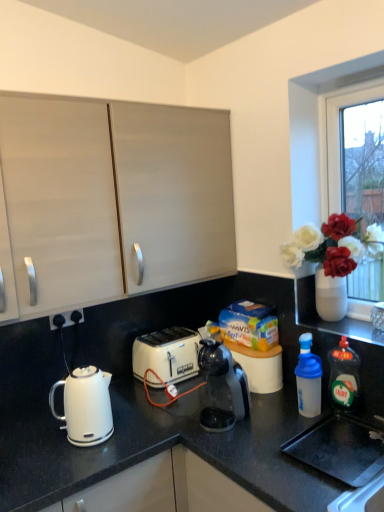
Looking at this image, in order to face green translucent bottle at right, acting as the 2th bottle starting from the left, should I rotate leftwards or rightwards?

To face it directly, rotate right by 19.124 degrees.

What is the approximate height of matte white cabinet at upper left?

30.91 inches.

Describe the element at coordinates (67, 318) in the screenshot. I see `black plastic electrical outlet at lower left` at that location.

What do you see at coordinates (167, 354) in the screenshot? This screenshot has width=384, height=512. I see `white plastic toaster at center` at bounding box center [167, 354].

The image size is (384, 512). Identify the location of transparent plastic coffee maker at center. (224, 379).

Image resolution: width=384 pixels, height=512 pixels. Identify the location of cabinetry on the left of green translucent bottle at right, acting as the 2th bottle starting from the left. (113, 198).

Is green translucent bottle at right, acting as the 1th bottle starting from the right, not near matte white cabinet at upper left?

green translucent bottle at right, acting as the 1th bottle starting from the right, is near matte white cabinet at upper left, not far away.

Based on the photo, who is shorter, green translucent bottle at right, acting as the 1th bottle starting from the right, or matte white cabinet at upper left?

With less height is green translucent bottle at right, acting as the 1th bottle starting from the right.

Measure the distance from green translucent bottle at right, acting as the 1th bottle starting from the right, to matte white cabinet at upper left.

A distance of 37.62 inches exists between green translucent bottle at right, acting as the 1th bottle starting from the right, and matte white cabinet at upper left.

Between transparent plastic bottle at right, positioned as the 1th bottle in left-to-right order, and matte white cabinet at upper left, which one is positioned in front?

Positioned in front is matte white cabinet at upper left.

Does transparent plastic bottle at right, the second bottle positioned from the right, turn towards matte white cabinet at upper left?

No, transparent plastic bottle at right, the second bottle positioned from the right, is not oriented towards matte white cabinet at upper left.

Does transparent plastic bottle at right, positioned as the 1th bottle in left-to-right order, contain matte white cabinet at upper left?

No, matte white cabinet at upper left is not surrounded by transparent plastic bottle at right, positioned as the 1th bottle in left-to-right order.

From a real-world perspective, starting from the matte white cabinet at upper left, which bottle is the 2nd one below it? Please provide its 2D coordinates.

[(308, 378)]

How far apart are black plastic electrical outlet at lower left and white plastic toaster at center?

16.18 inches.

Can you tell me how much black plastic electrical outlet at lower left and white plastic toaster at center differ in facing direction?

The angular difference between black plastic electrical outlet at lower left and white plastic toaster at center is 0.828 degrees.

Based on the photo, is white plastic toaster at center completely or partially inside black plastic electrical outlet at lower left?

No.

Consider the image. Who is shorter, black plastic electrical outlet at lower left or white plastic toaster at center?

Standing shorter between the two is black plastic electrical outlet at lower left.

Does transparent plastic bottle at right, the second bottle positioned from the right, lie in front of white glossy kettle at left?

No, it is behind white glossy kettle at left.

Can you tell me how much transparent plastic bottle at right, the second bottle positioned from the right, and white glossy kettle at left differ in facing direction?

The facing directions of transparent plastic bottle at right, the second bottle positioned from the right, and white glossy kettle at left are 89.6 degrees apart.

Can we say transparent plastic bottle at right, positioned as the 1th bottle in left-to-right order, lies outside white glossy kettle at left?

Yes.

Is transparent plastic bottle at right, positioned as the 1th bottle in left-to-right order, smaller than white glossy kettle at left?

Yes.

Image resolution: width=384 pixels, height=512 pixels. Identify the location of countertop below the white plastic toaster at center (from the image's perspective). (150, 405).

Is white plastic toaster at center in front of or behind white glossy electric kettle at lower left in the image?

white plastic toaster at center is positioned farther from the viewer than white glossy electric kettle at lower left.

Is white plastic toaster at center at the right side of white glossy electric kettle at lower left?

Correct, you'll find white plastic toaster at center to the right of white glossy electric kettle at lower left.

Is white plastic toaster at center inside or outside of white glossy electric kettle at lower left?

white plastic toaster at center exists outside the volume of white glossy electric kettle at lower left.

From the image's perspective, between black plastic electrical outlet at lower left and white glossy kettle at left, who is located below?

white glossy kettle at left.

The height and width of the screenshot is (512, 384). I want to click on electric outlet that appears above the white glossy kettle at left (from the image's perspective), so click(x=67, y=318).

Is black plastic electrical outlet at lower left completely or partially outside of white glossy kettle at left?

Yes, black plastic electrical outlet at lower left is located beyond the bounds of white glossy kettle at left.

Who is taller, black plastic electrical outlet at lower left or white glossy kettle at left?

white glossy kettle at left.

From a real-world perspective, is green translucent bottle at right, acting as the 2th bottle starting from the left, on transparent plastic coffee maker at center?

No, from a real-world perspective, green translucent bottle at right, acting as the 2th bottle starting from the left, is not on top of transparent plastic coffee maker at center.

Is green translucent bottle at right, acting as the 2th bottle starting from the left, closer to the viewer compared to transparent plastic coffee maker at center?

That is False.

Considering the sizes of green translucent bottle at right, acting as the 2th bottle starting from the left, and transparent plastic coffee maker at center in the image, is green translucent bottle at right, acting as the 2th bottle starting from the left, wider or thinner than transparent plastic coffee maker at center?

In the image, green translucent bottle at right, acting as the 2th bottle starting from the left, appears to be more narrow than transparent plastic coffee maker at center.

Which object is positioned more to the left, green translucent bottle at right, acting as the 2th bottle starting from the left, or transparent plastic coffee maker at center?

transparent plastic coffee maker at center is more to the left.

The image size is (384, 512). There is a green translucent bottle at right, acting as the 2th bottle starting from the left. Identify the location of cabinetry above it (from a real-world perspective). (113, 198).

Image resolution: width=384 pixels, height=512 pixels. I want to click on cabinetry in front of the transparent plastic bottle at right, the second bottle positioned from the right, so click(113, 198).

Based on their spatial positions, is white plastic toaster at center or black plastic electrical outlet at lower left closer to white glossy electric kettle at lower left?

white plastic toaster at center lies closer to white glossy electric kettle at lower left than the other object.

Considering their positions, is white glossy kettle at left positioned further to transparent plastic bottle at right, positioned as the 1th bottle in left-to-right order, than matte white cabinet at upper left?

The object further to transparent plastic bottle at right, positioned as the 1th bottle in left-to-right order, is matte white cabinet at upper left.

Considering their positions, is white glossy kettle at left positioned further to matte white cabinet at upper left than transparent plastic coffee maker at center?

Among the two, transparent plastic coffee maker at center is located further to matte white cabinet at upper left.

Looking at this image, looking at the image, which one is located further to white glossy kettle at left, white glossy electric kettle at lower left or green translucent bottle at right, acting as the 2th bottle starting from the left?

Based on the image, green translucent bottle at right, acting as the 2th bottle starting from the left, appears to be further to white glossy kettle at left.

Based on their spatial positions, is black plastic electrical outlet at lower left or white glossy electric kettle at lower left further from matte white cabinet at upper left?

The object further to matte white cabinet at upper left is black plastic electrical outlet at lower left.

Based on their spatial positions, is transparent plastic coffee maker at center or transparent plastic bottle at right, the second bottle positioned from the right, closer to white glossy electric kettle at lower left?

transparent plastic coffee maker at center is closer to white glossy electric kettle at lower left.

From the picture: Looking at the image, which one is located further to white glossy electric kettle at lower left, white plastic toaster at center or white glossy kettle at left?

white glossy kettle at left is positioned further to the anchor white glossy electric kettle at lower left.

Which object lies further to the anchor point matte white cabinet at upper left, white plastic toaster at center or white glossy kettle at left?

white plastic toaster at center is further to matte white cabinet at upper left.

The height and width of the screenshot is (512, 384). I want to click on electric outlet positioned between white glossy kettle at left and white plastic toaster at center from near to far, so click(67, 318).

Locate an element on the screen. This screenshot has width=384, height=512. kitchen appliance located between white plastic toaster at center and green translucent bottle at right, acting as the 1th bottle starting from the right, in the left-right direction is located at coordinates (224, 379).

At what (x,y) coordinates should I click in order to perform the action: click on toaster between white glossy kettle at left and transparent plastic bottle at right, positioned as the 1th bottle in left-to-right order, in the horizontal direction. Please return your answer as a coordinate pair (x, y). Looking at the image, I should click on pyautogui.click(x=167, y=354).

I want to click on kettle between white glossy electric kettle at lower left and white plastic toaster at center in the front-back direction, so click(x=85, y=406).